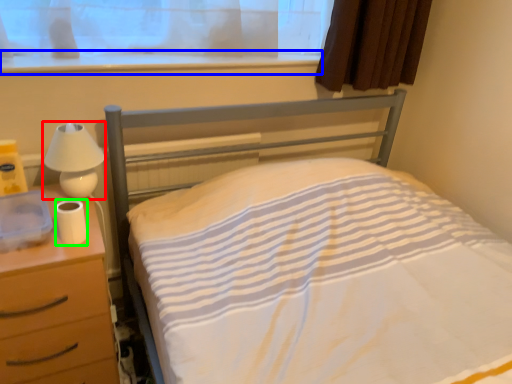
Question: Which is nearer to the lamp (highlighted by a red box)? window sill (highlighted by a blue box) or toilet paper (highlighted by a green box).

Choices:
 (A) window sill
 (B) toilet paper

Answer: (B)